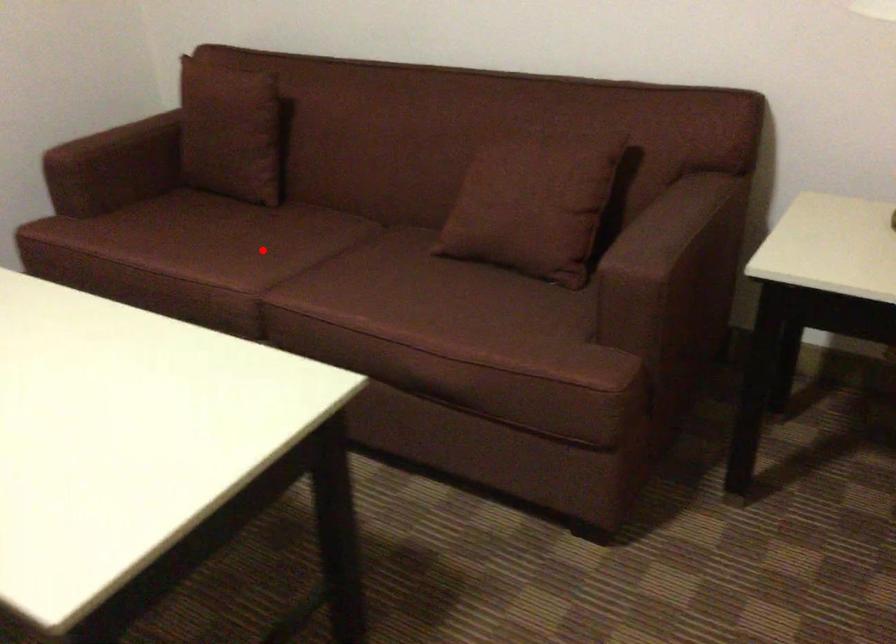
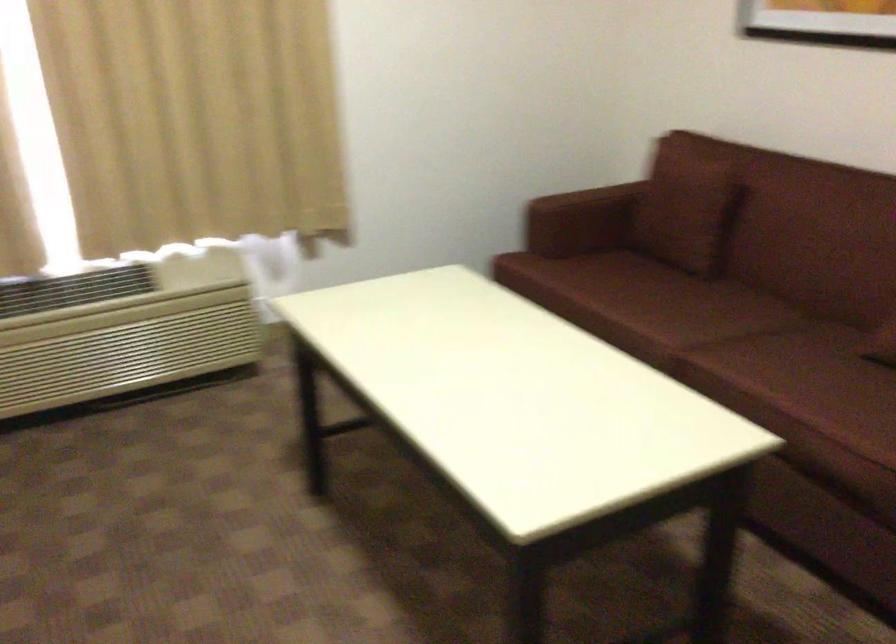
Where in the second image is the point corresponding to the highlighted location from the first image?

(682, 310)